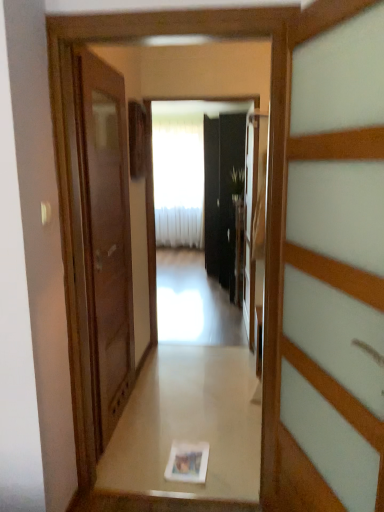
This screenshot has width=384, height=512. In order to click on space that is in front of glossy black mirror at center in this screenshot , I will do `click(201, 359)`.